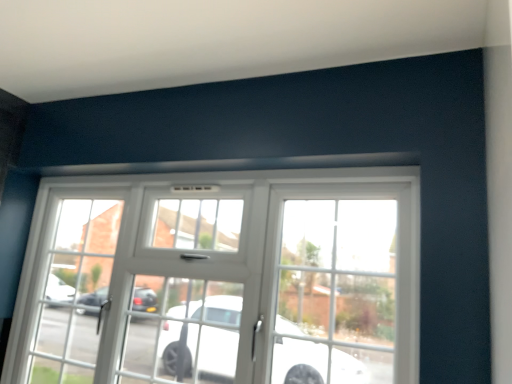
Question: Should I look upward or downward to see white plastic window at center?

Choices:
 (A) up
 (B) down

Answer: (B)